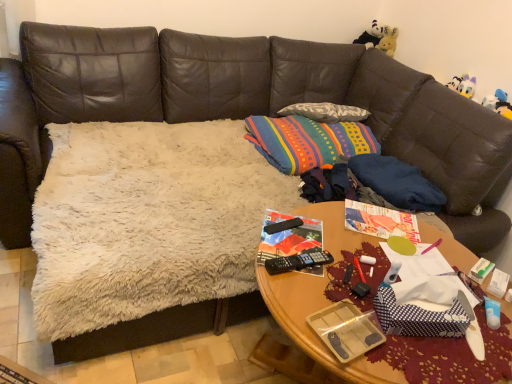
Where is `vacant space to the right of clear plastic tray at center`? Image resolution: width=512 pixels, height=384 pixels. vacant space to the right of clear plastic tray at center is located at coordinates (408, 362).